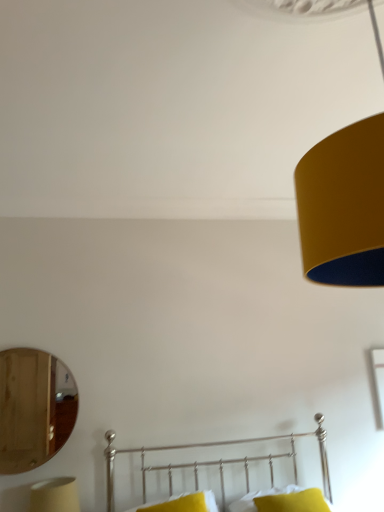
In order to click on free space above matte yellow lampshade at lower left (from a real-world perspective) in this screenshot , I will do `click(57, 482)`.